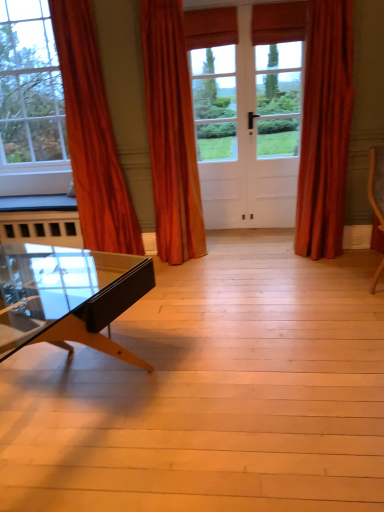
Question: Is orange velvet curtain at left, the 3th curtain when ordered from right to left, situated inside orange velvet curtain at center, the 2th curtain positioned from the right, or outside?

Choices:
 (A) outside
 (B) inside

Answer: (A)

Question: Is orange velvet curtain at left, the 1th curtain when ordered from left to right, taller or shorter than orange velvet curtain at center, the 2th curtain positioned from the right?

Choices:
 (A) short
 (B) tall

Answer: (B)

Question: Which of these objects is positioned farthest from the orange velvet curtain at left, the 3th curtain when ordered from right to left?

Choices:
 (A) velvet orange curtain at right, which is the 3th curtain in left-to-right order
 (B) orange velvet curtain at center, the 2th curtain positioned from the right

Answer: (A)

Question: Estimate the real-world distances between objects in this image. Which object is closer to the orange velvet curtain at left, the 1th curtain when ordered from left to right?

Choices:
 (A) velvet orange curtain at right, which is the 3th curtain in left-to-right order
 (B) orange velvet curtain at center, which is the 2th curtain from left to right

Answer: (B)